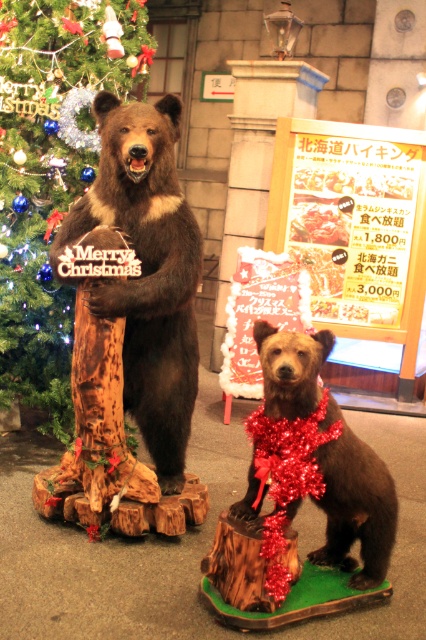
Question: Among these points, which one is nearest to the camera?

Choices:
 (A) (367, 474)
 (B) (46, 115)

Answer: (A)

Question: Does green matte christmas tree at left appear on the right side of shiny brown bear at center?

Choices:
 (A) no
 (B) yes

Answer: (A)

Question: Does green matte christmas tree at left lie in front of shiny brown bear at center?

Choices:
 (A) no
 (B) yes

Answer: (A)

Question: Which point is farther from the camera taking this photo?

Choices:
 (A) (178, 376)
 (B) (8, 349)

Answer: (B)

Question: From the image, what is the correct spatial relationship of shiny brown bear at center in relation to shiny red tinsel at center?

Choices:
 (A) below
 (B) above

Answer: (B)

Question: Which object is the closest to the shiny brown bear at center?

Choices:
 (A) green matte christmas tree at left
 (B) shiny red tinsel at center

Answer: (A)